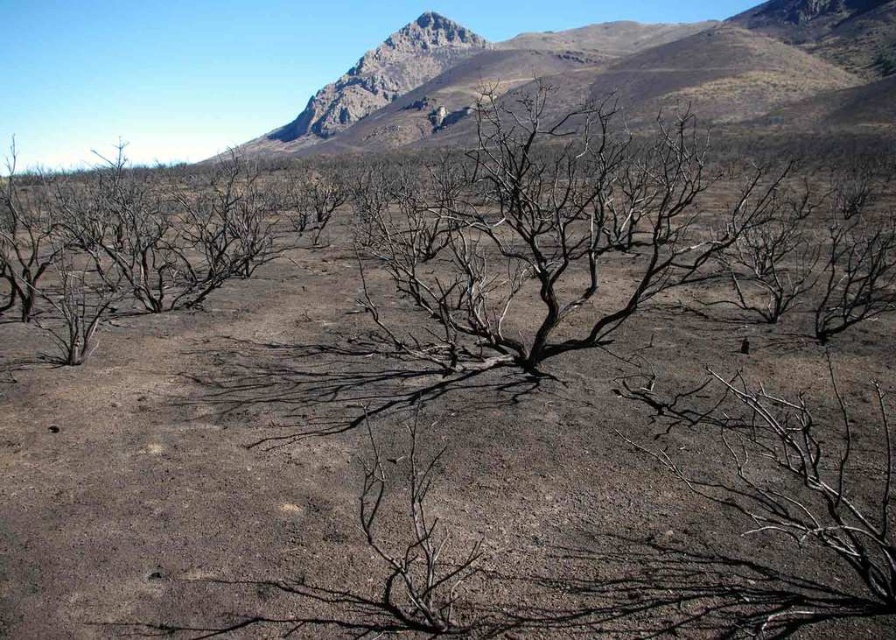
Question: Is dark brown dirt field at center positioned in front of charred wood tree at center?

Choices:
 (A) yes
 (B) no

Answer: (A)

Question: Which object appears farthest from the camera in this image?

Choices:
 (A) dark brown dirt field at center
 (B) charred wood tree at center

Answer: (B)

Question: Does dark brown dirt field at center appear on the right side of charred wood tree at center?

Choices:
 (A) no
 (B) yes

Answer: (A)

Question: Among these points, which one is nearest to the camera?

Choices:
 (A) (535, 256)
 (B) (115, 433)

Answer: (B)

Question: Is dark brown dirt field at center further to camera compared to charred wood tree at center?

Choices:
 (A) yes
 (B) no

Answer: (B)